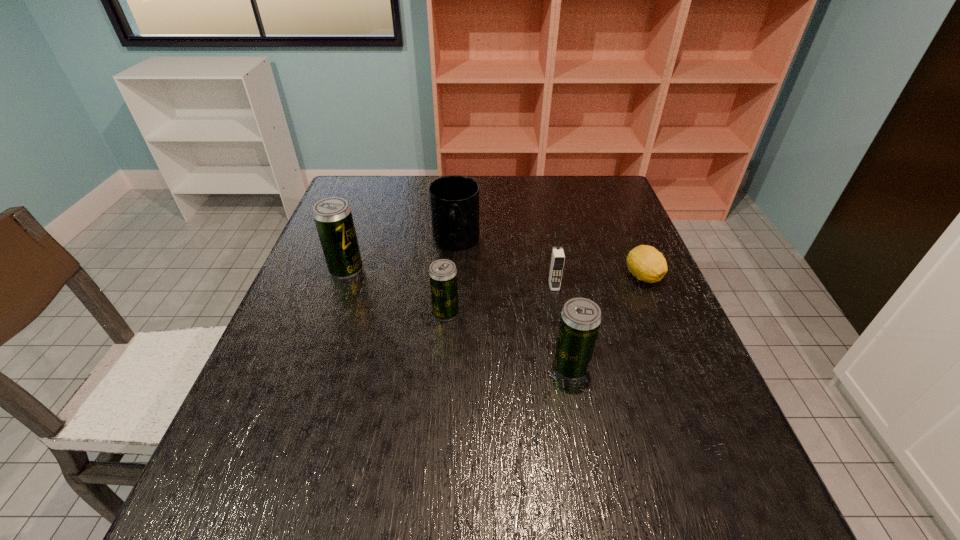
Please point a free position for a beer can on the right. Please provide its 2D coordinates. Your answer should be formatted as a tuple, i.e. [(x, y)], where the tuple contains the x and y coordinates of a point satisfying the conditions above.

[(732, 437)]